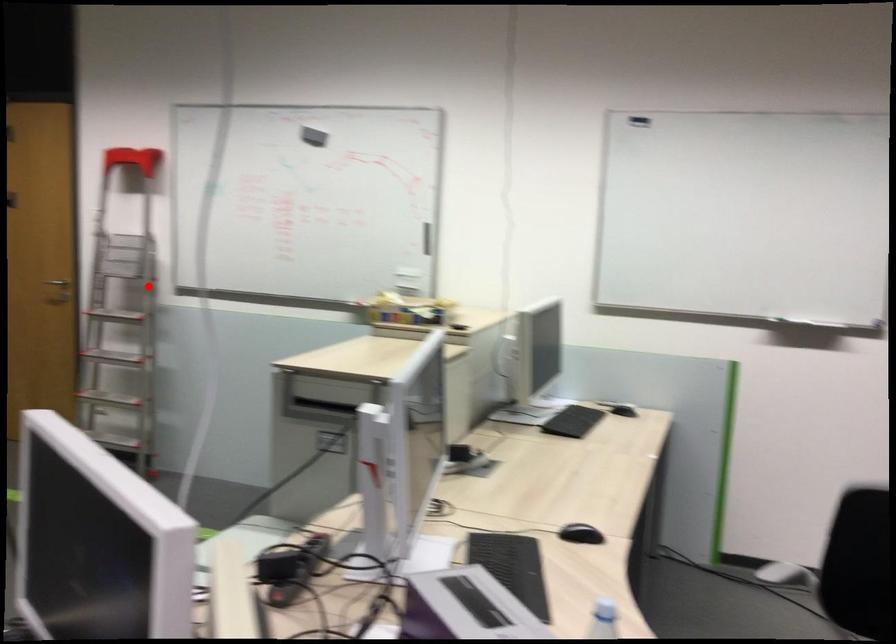
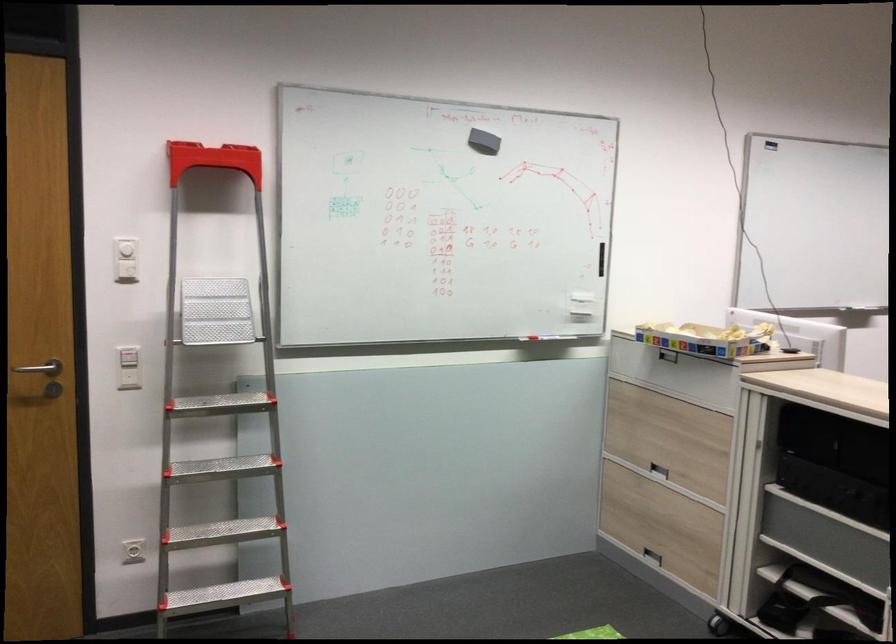
Question: I am providing you with two images of the same scene from different viewpoints. Given a red point in image1, look at the same physical point in image2. Is it:

Choices:
 (A) Closer to the viewpoint
 (B) Farther from the viewpoint

Answer: (A)